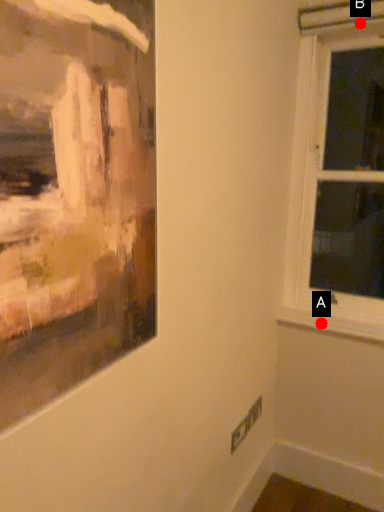
Question: Two points are circled on the image, labeled by A and B beside each circle. Which point is farther from the camera taking this photo?

Choices:
 (A) A is further
 (B) B is further

Answer: (A)